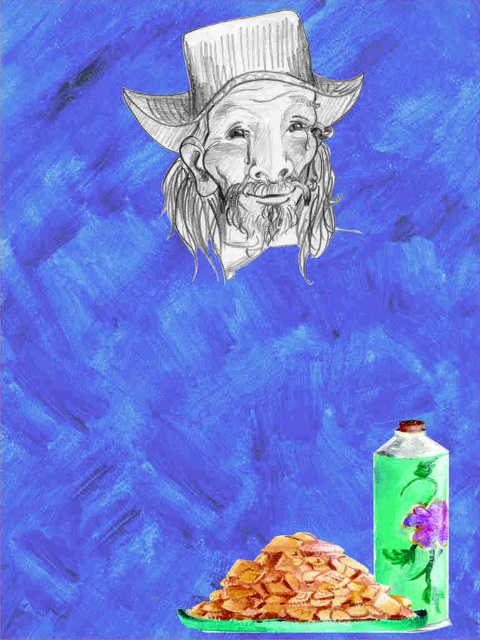
How distant is graphite pencil cowboy hat at upper center from golden crispy chips at lower center?

graphite pencil cowboy hat at upper center and golden crispy chips at lower center are 14.21 inches apart.

From the picture: Can you confirm if graphite pencil cowboy hat at upper center is positioned to the right of golden crispy chips at lower center?

No, graphite pencil cowboy hat at upper center is not to the right of golden crispy chips at lower center.

Image resolution: width=480 pixels, height=640 pixels. Identify the location of graphite pencil cowboy hat at upper center. (240, 74).

Is green glass bottle at lower right above golden crispy chips at lower center?

Correct, green glass bottle at lower right is located above golden crispy chips at lower center.

Does green glass bottle at lower right have a lesser height compared to golden crispy chips at lower center?

In fact, green glass bottle at lower right may be taller than golden crispy chips at lower center.

Does point (445, 605) lie in front of point (229, 614)?

No, (445, 605) is behind (229, 614).

The image size is (480, 640). In order to click on green glass bottle at lower right in this screenshot , I will do `click(412, 518)`.

Which is more to the right, green glass bottle at lower right or gray/rough beard at upper center?

Positioned to the right is green glass bottle at lower right.

Between point (395, 528) and point (232, 193), which one is positioned in front?

Point (395, 528) is in front.

Find the location of a particular element. The image size is (480, 640). green glass bottle at lower right is located at coordinates (412, 518).